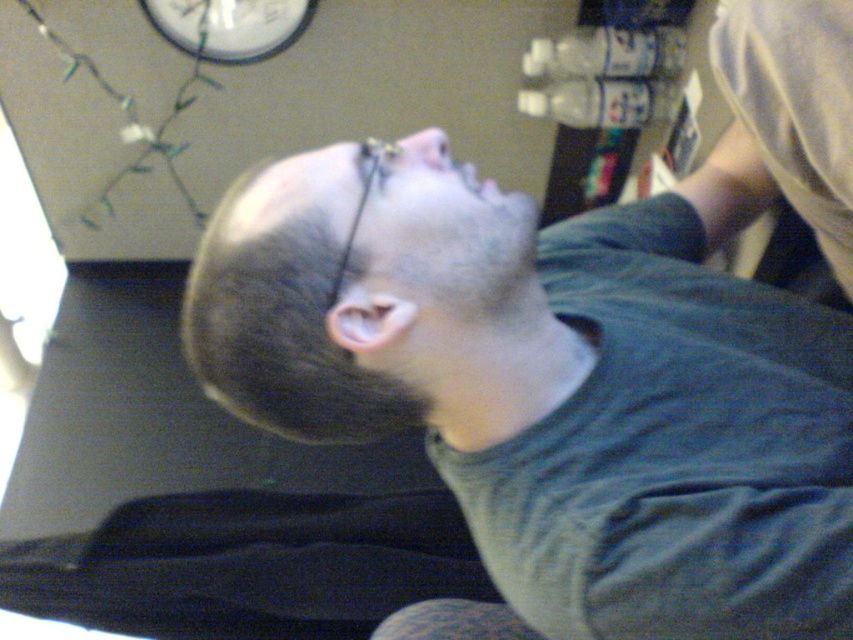
Can you confirm if dark green t-shirt at center is smaller than white plastic clock at upper center?

No.

Does dark green t-shirt at center appear on the right side of white plastic clock at upper center?

Yes, dark green t-shirt at center is to the right of white plastic clock at upper center.

You are a GUI agent. You are given a task and a screenshot of the screen. Output one action in this format:
    pyautogui.click(x=<x>, y=<y>)
    Task: Click on the dark green t-shirt at center
    This screenshot has height=640, width=853.
    Given the screenshot: What is the action you would take?
    pyautogui.click(x=552, y=380)

Is dark green t-shirt at center bigger than dark green fabric at upper center?

Indeed, dark green t-shirt at center has a larger size compared to dark green fabric at upper center.

Does dark green t-shirt at center have a greater height compared to dark green fabric at upper center?

Yes.

Image resolution: width=853 pixels, height=640 pixels. In order to click on dark green t-shirt at center in this screenshot , I will do `click(552, 380)`.

Identify the location of dark green t-shirt at center. The width and height of the screenshot is (853, 640). (552, 380).

Can you confirm if dark green fabric at upper center is wider than white plastic clock at upper center?

No, dark green fabric at upper center is not wider than white plastic clock at upper center.

Can you confirm if dark green fabric at upper center is positioned below white plastic clock at upper center?

Yes, dark green fabric at upper center is below white plastic clock at upper center.

Between point (291, 365) and point (164, 3), which one is positioned behind?

The point (164, 3) is more distant.

Find the location of a particular element. dark green fabric at upper center is located at coordinates (376, 300).